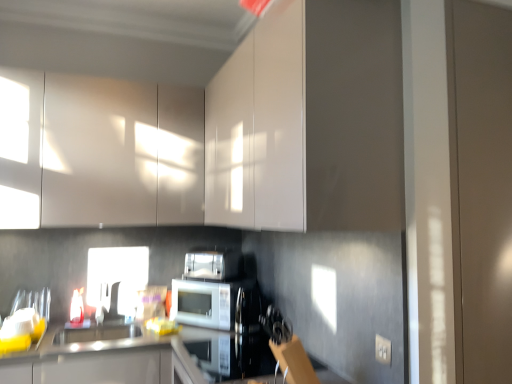
Question: Is satin silver toaster at center positioned far away from white glossy sink at lower center?

Choices:
 (A) no
 (B) yes

Answer: (A)

Question: Is satin silver toaster at center thinner than white glossy sink at lower center?

Choices:
 (A) yes
 (B) no

Answer: (A)

Question: Is satin silver toaster at center to the left of white glossy sink at lower center from the viewer's perspective?

Choices:
 (A) yes
 (B) no

Answer: (B)

Question: Is satin silver toaster at center facing towards white glossy sink at lower center?

Choices:
 (A) no
 (B) yes

Answer: (A)

Question: Does satin silver toaster at center have a greater width compared to white glossy sink at lower center?

Choices:
 (A) yes
 (B) no

Answer: (B)

Question: Is the surface of satin silver toaster at center in direct contact with white glossy sink at lower center?

Choices:
 (A) no
 (B) yes

Answer: (A)

Question: Are glossy white cabinet at upper center, placed as the second cabinetry when sorted from left to right, and white glossy sink at lower center located far from each other?

Choices:
 (A) yes
 (B) no

Answer: (B)

Question: Is glossy white cabinet at upper center, which is counted as the 1th cabinetry, starting from the right, smaller than white glossy sink at lower center?

Choices:
 (A) yes
 (B) no

Answer: (B)

Question: Is glossy white cabinet at upper center, placed as the second cabinetry when sorted from left to right, oriented away from white glossy sink at lower center?

Choices:
 (A) no
 (B) yes

Answer: (A)

Question: From the image's perspective, would you say glossy white cabinet at upper center, placed as the second cabinetry when sorted from left to right, is shown under white glossy sink at lower center?

Choices:
 (A) no
 (B) yes

Answer: (A)

Question: Would you say glossy white cabinet at upper center, which is counted as the 1th cabinetry, starting from the right, contains white glossy sink at lower center?

Choices:
 (A) no
 (B) yes

Answer: (A)

Question: Does glossy white cabinet at upper center, which is counted as the 1th cabinetry, starting from the right, have a lesser width compared to white glossy sink at lower center?

Choices:
 (A) yes
 (B) no

Answer: (B)

Question: Is glossy white cabinet at upper center, which is counted as the 1th cabinetry, starting from the right, wider than white plastic electric outlet at lower right?

Choices:
 (A) no
 (B) yes

Answer: (B)